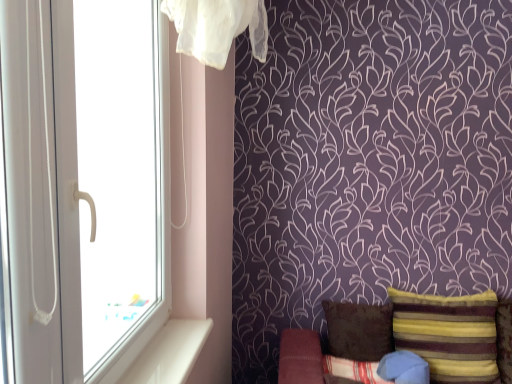
Question: Is white plastic window at left facing towards blue cotton pillow at lower right, which is the second pillow in left-to-right order?

Choices:
 (A) yes
 (B) no

Answer: (B)

Question: Is white plastic window at left positioned far away from blue cotton pillow at lower right, which is the second pillow in left-to-right order?

Choices:
 (A) yes
 (B) no

Answer: (A)

Question: From a real-world perspective, is white plastic window at left on top of blue cotton pillow at lower right, which is the second pillow in left-to-right order?

Choices:
 (A) no
 (B) yes

Answer: (B)

Question: Considering the relative sizes of white plastic window at left and blue cotton pillow at lower right, which appears as the 3th pillow when viewed from the right, in the image provided, is white plastic window at left smaller than blue cotton pillow at lower right, which appears as the 3th pillow when viewed from the right,?

Choices:
 (A) no
 (B) yes

Answer: (A)

Question: Can blue cotton pillow at lower right, which is the second pillow in left-to-right order, be found inside white plastic window at left?

Choices:
 (A) no
 (B) yes

Answer: (A)

Question: From a real-world perspective, is blue cotton pillow at lower right, which appears as the 3th pillow when viewed from the right, physically located above or below striped velvet pillow at lower right, marked as the 4th pillow in a left-to-right arrangement?

Choices:
 (A) above
 (B) below

Answer: (B)

Question: Is blue cotton pillow at lower right, which appears as the 3th pillow when viewed from the right, inside the boundaries of striped velvet pillow at lower right, marked as the 4th pillow in a left-to-right arrangement, or outside?

Choices:
 (A) inside
 (B) outside

Answer: (B)

Question: In terms of width, does blue cotton pillow at lower right, which appears as the 3th pillow when viewed from the right, look wider or thinner when compared to striped velvet pillow at lower right, marked as the 4th pillow in a left-to-right arrangement?

Choices:
 (A) wide
 (B) thin

Answer: (B)

Question: From the image's perspective, relative to striped velvet pillow at lower right, marked as the 4th pillow in a left-to-right arrangement, is blue cotton pillow at lower right, which is the second pillow in left-to-right order, above or below?

Choices:
 (A) above
 (B) below

Answer: (B)

Question: Is brown fabric pillow at lower right, the 1th pillow in the left-to-right sequence, bigger or smaller than blue fabric pillow at lower right, acting as the 2th pillow starting from the right?

Choices:
 (A) small
 (B) big

Answer: (B)

Question: Is brown fabric pillow at lower right, the 1th pillow in the left-to-right sequence, in front of or behind blue fabric pillow at lower right, acting as the 2th pillow starting from the right, in the image?

Choices:
 (A) front
 (B) behind

Answer: (B)

Question: From a real-world perspective, relative to blue fabric pillow at lower right, acting as the 2th pillow starting from the right, is brown fabric pillow at lower right, which ranks as the 4th pillow in right-to-left order, vertically above or below?

Choices:
 (A) below
 (B) above

Answer: (B)

Question: Is brown fabric pillow at lower right, the 1th pillow in the left-to-right sequence, taller or shorter than blue fabric pillow at lower right, the 3th pillow in the left-to-right sequence?

Choices:
 (A) tall
 (B) short

Answer: (A)

Question: Visually, is striped velvet pillow at lower right, marked as the 4th pillow in a left-to-right arrangement, positioned to the left or to the right of brown fabric pillow at lower right, the 1th pillow in the left-to-right sequence?

Choices:
 (A) left
 (B) right

Answer: (B)

Question: Is striped velvet pillow at lower right, marked as the 4th pillow in a left-to-right arrangement, wider or thinner than brown fabric pillow at lower right, which ranks as the 4th pillow in right-to-left order?

Choices:
 (A) thin
 (B) wide

Answer: (B)